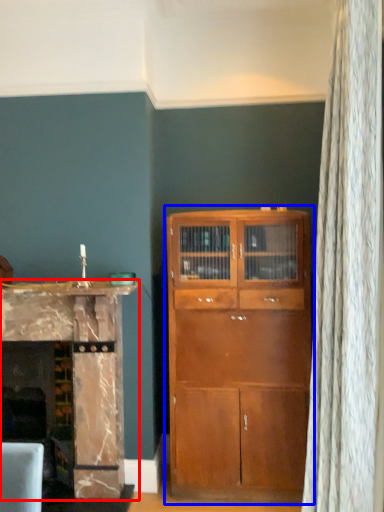
Question: Which object appears closest to the camera in this image, cabinetry (highlighted by a red box) or cupboard (highlighted by a blue box)?

Choices:
 (A) cabinetry
 (B) cupboard

Answer: (A)